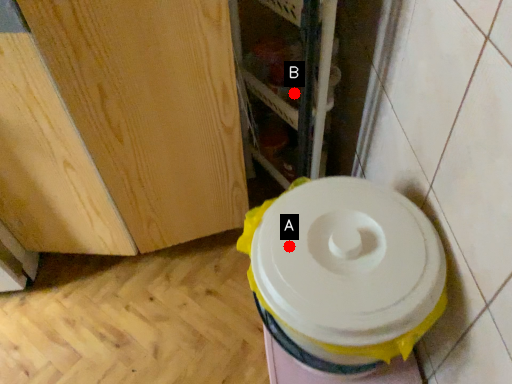
Question: Two points are circled on the image, labeled by A and B beside each circle. Which point is closer to the camera taking this photo?

Choices:
 (A) A is closer
 (B) B is closer

Answer: (A)